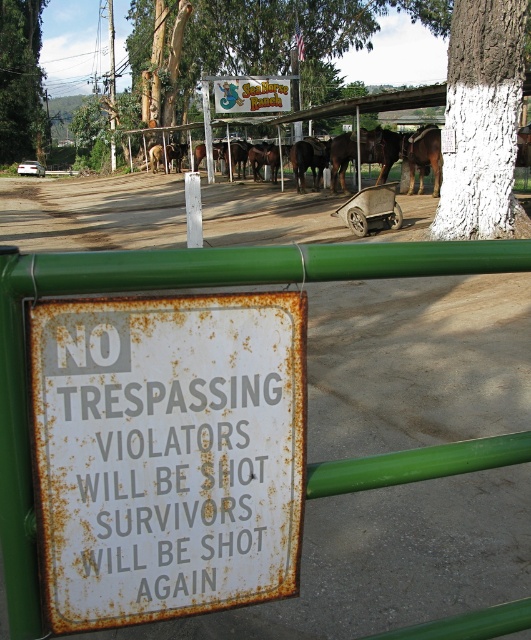
Question: Which point is closer to the camera taking this photo?

Choices:
 (A) (489, 122)
 (B) (173, 435)

Answer: (B)

Question: Which point is farther from the camera taking this photo?

Choices:
 (A) (24, 84)
 (B) (302, 490)
 (C) (475, 45)

Answer: (A)

Question: Can you confirm if rusty metal sign at center is bigger than green rough bark tree at upper left?

Choices:
 (A) no
 (B) yes

Answer: (A)

Question: Which object appears closest to the camera in this image?

Choices:
 (A) green rough bark tree at upper left
 (B) rusty metal sign at center

Answer: (B)

Question: Is rusty metal sign at center to the left of white painted bark at upper center from the viewer's perspective?

Choices:
 (A) yes
 (B) no

Answer: (A)

Question: In this image, where is rusty metal sign at center located relative to white painted bark at upper center?

Choices:
 (A) left
 (B) right

Answer: (A)